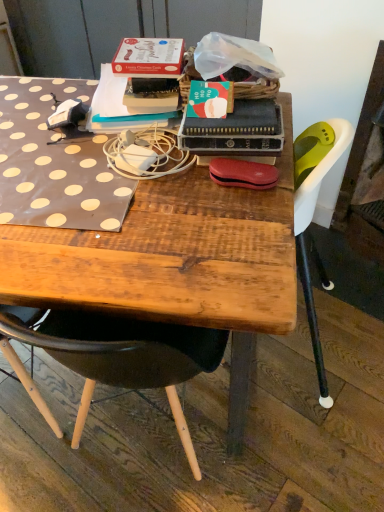
At what (x,y) coordinates should I click in order to perform the action: click on free space in front of white matte charger at center. Please return your answer as a coordinate pair (x, y). The width and height of the screenshot is (384, 512). Looking at the image, I should click on (131, 204).